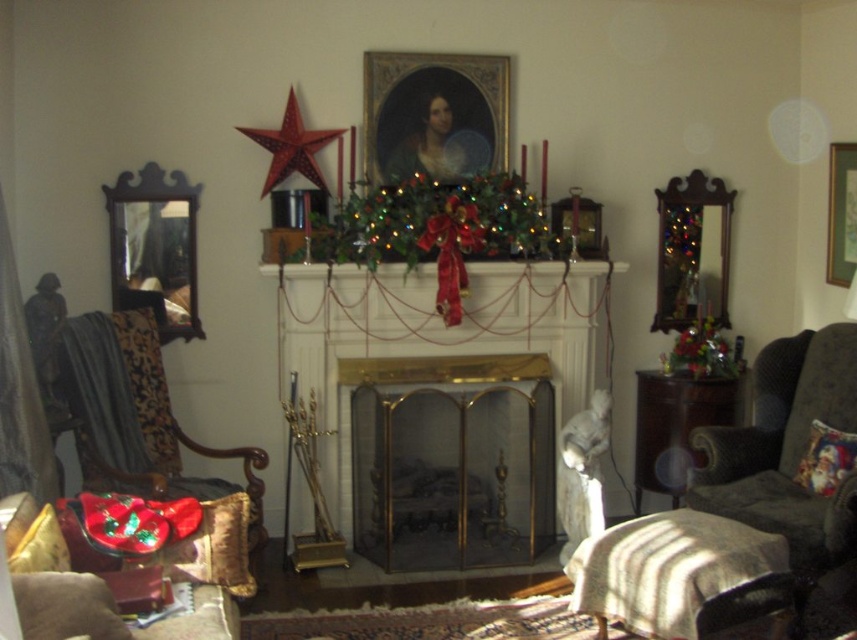
Consider the image. Can you confirm if shiny green garland at center is taller than wooden picture frame at upper right?

No.

Does shiny green garland at center appear over wooden picture frame at upper right?

Incorrect, shiny green garland at center is not positioned above wooden picture frame at upper right.

Which is behind, point (460, 208) or point (843, 221)?

Point (843, 221)

Locate an element on the screen. shiny green garland at center is located at coordinates (436, 221).

Between gold metallic fireplace at center and velvet cushioned chair at left, which one has less height?

velvet cushioned chair at left

Does gold metallic fireplace at center come behind velvet cushioned chair at left?

Yes, it is.

Describe the element at coordinates (451, 460) in the screenshot. Image resolution: width=857 pixels, height=640 pixels. I see `gold metallic fireplace at center` at that location.

Locate an element on the screen. The width and height of the screenshot is (857, 640). gold metallic fireplace at center is located at coordinates (451, 460).

Which is more to the right, gold-framed portrait at center or wooden picture frame at upper right?

From the viewer's perspective, wooden picture frame at upper right appears more on the right side.

Does point (492, 93) lie behind point (835, 227)?

No, (492, 93) is in front of (835, 227).

Is point (375, 122) closer to viewer compared to point (835, 173)?

That is True.

This screenshot has height=640, width=857. I want to click on gold-framed portrait at center, so click(x=434, y=115).